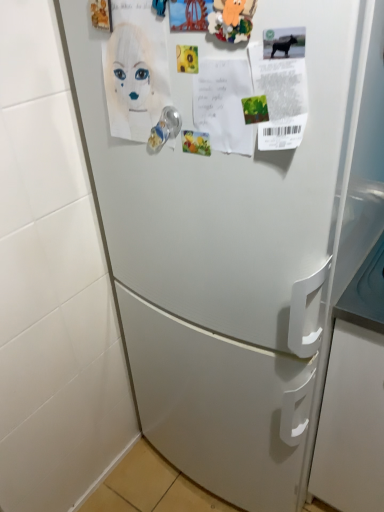
In order to face white paper at upper left, should I rotate leftwards or rightwards?

Rotate left and turn 7.865 degrees.

At what (x,y) coordinates should I click in order to perform the action: click on white paper at upper left. Please return your answer as a coordinate pair (x, y). Looking at the image, I should click on (135, 78).

What do you see at coordinates (135, 78) in the screenshot?
I see `white paper at upper left` at bounding box center [135, 78].

What do you see at coordinates (165, 128) in the screenshot?
I see `clear plastic door handle at center` at bounding box center [165, 128].

Locate an element on the screen. clear plastic door handle at center is located at coordinates (165, 128).

Where is `white paper at upper left`? This screenshot has height=512, width=384. white paper at upper left is located at coordinates (135, 78).

Would you say clear plastic door handle at center is to the left or to the right of white paper at upper left in the picture?

Based on their positions, clear plastic door handle at center is located to the right of white paper at upper left.

Considering their positions, is clear plastic door handle at center located in front of or behind white paper at upper left?

Clearly, clear plastic door handle at center is behind white paper at upper left.

Is point (171, 129) behind point (157, 42)?

Yes, point (171, 129) is behind point (157, 42).

From the image's perspective, is clear plastic door handle at center located above white paper at upper left?

No, from the image's perspective, clear plastic door handle at center is not over white paper at upper left.

From a real-world perspective, is clear plastic door handle at center above or below white paper at upper left?

clear plastic door handle at center is below white paper at upper left.

Considering the relative sizes of clear plastic door handle at center and white paper at upper left in the image provided, is clear plastic door handle at center thinner than white paper at upper left?

Yes.

Considering the sizes of objects clear plastic door handle at center and white paper at upper left in the image provided, who is taller, clear plastic door handle at center or white paper at upper left?

white paper at upper left is taller.

Considering the relative sizes of clear plastic door handle at center and white paper at upper left in the image provided, is clear plastic door handle at center smaller than white paper at upper left?

Yes.

Consider the image. Could white paper at upper left be considered to be inside clear plastic door handle at center?

No, clear plastic door handle at center does not contain white paper at upper left.

Is the surface of clear plastic door handle at center in direct contact with white paper at upper left?

Yes, clear plastic door handle at center is with white paper at upper left.

Is clear plastic door handle at center looking in the opposite direction of white paper at upper left?

Yes.

How much distance is there between clear plastic door handle at center and white paper at upper left?

clear plastic door handle at center is 3.05 inches from white paper at upper left.

Where is `woman that is in front of the clear plastic door handle at center`? This screenshot has width=384, height=512. woman that is in front of the clear plastic door handle at center is located at coordinates (135, 78).

Based on their positions, is white paper at upper left located to the left or right of clear plastic door handle at center?

white paper at upper left is positioned on clear plastic door handle at center's left side.

Which object is closer to the camera taking this photo, white paper at upper left or clear plastic door handle at center?

white paper at upper left is closer to the camera.

Which point is more distant from viewer, (142, 126) or (166, 126)?

The point (142, 126) is farther.

In the scene shown: From the image's perspective, is white paper at upper left beneath clear plastic door handle at center?

Incorrect, from the image's perspective, white paper at upper left is higher than clear plastic door handle at center.

From a real-world perspective, who is located lower, white paper at upper left or clear plastic door handle at center?

In real-world perspective, clear plastic door handle at center is lower.

Between white paper at upper left and clear plastic door handle at center, which one has larger width?

Wider between the two is white paper at upper left.

Does white paper at upper left have a lesser height compared to clear plastic door handle at center?

No.

Considering the sizes of objects white paper at upper left and clear plastic door handle at center in the image provided, who is bigger, white paper at upper left or clear plastic door handle at center?

white paper at upper left.

Is white paper at upper left not inside clear plastic door handle at center?

That's correct, white paper at upper left is outside of clear plastic door handle at center.

Is white paper at upper left far away from clear plastic door handle at center?

white paper at upper left is near clear plastic door handle at center, not far away.

Is white paper at upper left oriented away from clear plastic door handle at center?

Yes, white paper at upper left is facing away from clear plastic door handle at center.

How different are the orientations of white paper at upper left and clear plastic door handle at center in degrees?

white paper at upper left and clear plastic door handle at center are facing 10.2 degrees away from each other.

From the picture: Measure the distance from white paper at upper left to clear plastic door handle at center.

A distance of 3.05 inches exists between white paper at upper left and clear plastic door handle at center.

Locate an element on the screen. The image size is (384, 512). woman that appears in front of the clear plastic door handle at center is located at coordinates (135, 78).

The image size is (384, 512). What are the coordinates of `woman that appears above the clear plastic door handle at center (from the image's perspective)` in the screenshot? It's located at (135, 78).

Where is `woman in front of the clear plastic door handle at center`? This screenshot has height=512, width=384. woman in front of the clear plastic door handle at center is located at coordinates (135, 78).